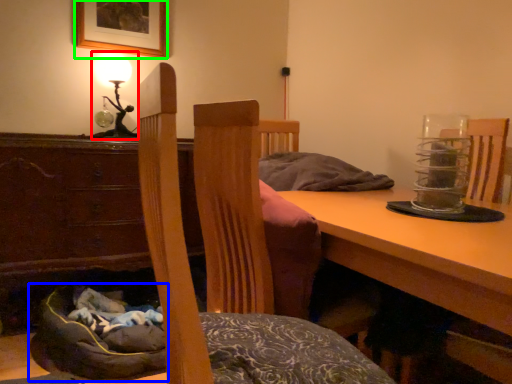
Question: Which object is the closest to the table lamp (highlighted by a red box)? Choose among these: bean bag chair (highlighted by a blue box) or picture frame (highlighted by a green box).

Choices:
 (A) bean bag chair
 (B) picture frame

Answer: (B)